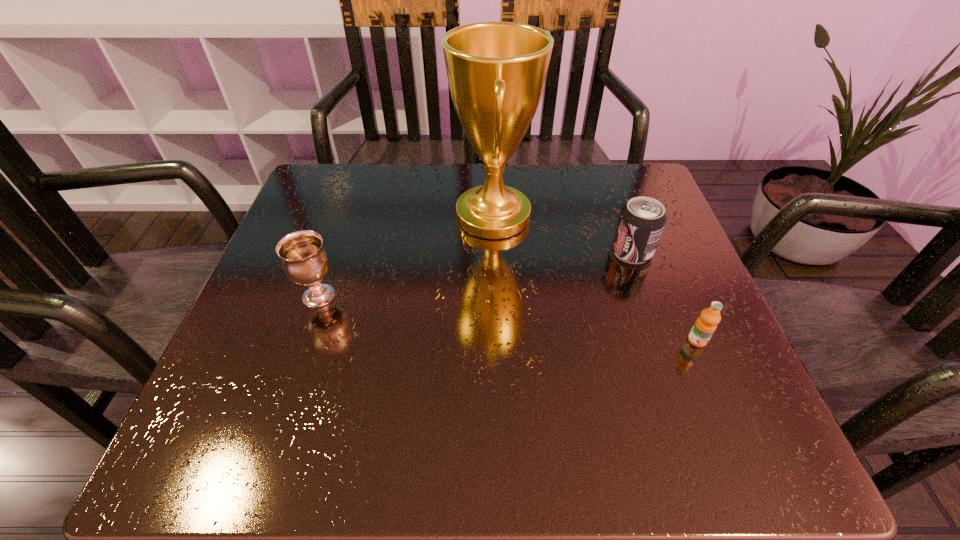
Where is `vacant position at the right edge of the desktop`? The width and height of the screenshot is (960, 540). vacant position at the right edge of the desktop is located at coordinates (653, 279).

You are a GUI agent. You are given a task and a screenshot of the screen. Output one action in this format:
    pyautogui.click(x=<x>, y=<y>)
    Task: Click on the free space at the far left corner
    
    Given the screenshot: What is the action you would take?
    pyautogui.click(x=371, y=167)

This screenshot has height=540, width=960. In the image, there is a desktop. In order to click on blank space at the far right corner in this screenshot , I will do `click(616, 219)`.

Find the location of a particular element. The width and height of the screenshot is (960, 540). vacant space at the near right corner of the desktop is located at coordinates (759, 431).

The height and width of the screenshot is (540, 960). What are the coordinates of `free space between the rightmost object and the soda can` in the screenshot? It's located at pyautogui.click(x=664, y=296).

Identify the location of free point between the chalice and the orange juice. The image size is (960, 540). (508, 318).

What are the coordinates of `free space between the shortest object and the chalice` in the screenshot? It's located at (508, 318).

Identify the location of free area in between the rightmost object and the tallest object. (595, 278).

The width and height of the screenshot is (960, 540). Identify the location of free space between the second nearest object and the nearest object. (508, 318).

At what (x,y) coordinates should I click in order to perform the action: click on vacant point located between the leftmost object and the soda can. Please return your answer as a coordinate pair (x, y). This screenshot has width=960, height=540. Looking at the image, I should click on (475, 274).